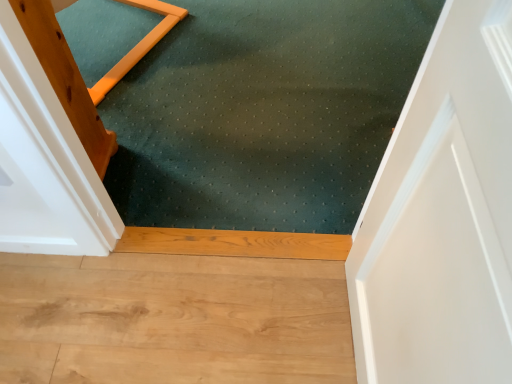
Image resolution: width=512 pixels, height=384 pixels. What do you see at coordinates (173, 320) in the screenshot?
I see `light brown wood flooring at lower center` at bounding box center [173, 320].

Measure the distance between point (138, 372) and camera.

1.07 meters.

Locate an element on the screen. This screenshot has height=384, width=512. light brown wood flooring at lower center is located at coordinates coord(173,320).

What do you see at coordinates (264, 113) in the screenshot?
I see `green textured mat at center` at bounding box center [264, 113].

Find the location of a particular element. This screenshot has height=384, width=512. green textured mat at center is located at coordinates (264, 113).

Where is `light brown wood flooring at lower center`? Image resolution: width=512 pixels, height=384 pixels. light brown wood flooring at lower center is located at coordinates (173, 320).

Which is more to the right, light brown wood flooring at lower center or green textured mat at center?

From the viewer's perspective, green textured mat at center appears more on the right side.

Is light brown wood flooring at lower center behind green textured mat at center?

No, it is in front of green textured mat at center.

Is point (177, 353) positioned before point (333, 178)?

Yes, it is.

From the image's perspective, relative to green textured mat at center, is light brown wood flooring at lower center above or below?

From the image's perspective, light brown wood flooring at lower center appears below green textured mat at center.

From a real-world perspective, is light brown wood flooring at lower center on top of green textured mat at center?

Incorrect, from a real-world perspective, light brown wood flooring at lower center is lower than green textured mat at center.

Does light brown wood flooring at lower center have a lesser width compared to green textured mat at center?

Correct, the width of light brown wood flooring at lower center is less than that of green textured mat at center.

Which of these two, light brown wood flooring at lower center or green textured mat at center, stands taller?

With more height is light brown wood flooring at lower center.

Considering the sizes of objects light brown wood flooring at lower center and green textured mat at center in the image provided, who is smaller, light brown wood flooring at lower center or green textured mat at center?

light brown wood flooring at lower center is smaller.

Can we say light brown wood flooring at lower center lies outside green textured mat at center?

Indeed, light brown wood flooring at lower center is completely outside green textured mat at center.

Would you consider light brown wood flooring at lower center to be distant from green textured mat at center?

No, light brown wood flooring at lower center is in close proximity to green textured mat at center.

Is light brown wood flooring at lower center positioned with its back to green textured mat at center?

light brown wood flooring at lower center is not turned away from green textured mat at center.

What's the angular difference between light brown wood flooring at lower center and green textured mat at center's facing directions?

The angle between the facing direction of light brown wood flooring at lower center and the facing direction of green textured mat at center is 180 degrees.

Locate an element on the screen. mat that is behind the light brown wood flooring at lower center is located at coordinates (264, 113).

In the scene shown: Is green textured mat at center to the left of light brown wood flooring at lower center from the viewer's perspective?

No.

Considering the relative positions of green textured mat at center and light brown wood flooring at lower center in the image provided, is green textured mat at center behind light brown wood flooring at lower center?

That is True.

Which is behind, point (303, 132) or point (24, 311)?

The point (303, 132) is behind.

From the image's perspective, would you say green textured mat at center is shown under light brown wood flooring at lower center?

No, from the image's perspective, green textured mat at center is not beneath light brown wood flooring at lower center.

From a real-world perspective, is green textured mat at center positioned above or below light brown wood flooring at lower center?

green textured mat at center is above light brown wood flooring at lower center.

Is green textured mat at center thinner than light brown wood flooring at lower center?

Incorrect, the width of green textured mat at center is not less than that of light brown wood flooring at lower center.

In terms of height, does green textured mat at center look taller or shorter compared to light brown wood flooring at lower center?

In the image, green textured mat at center appears to be shorter than light brown wood flooring at lower center.

Considering the sizes of green textured mat at center and light brown wood flooring at lower center in the image, is green textured mat at center bigger or smaller than light brown wood flooring at lower center?

green textured mat at center is bigger than light brown wood flooring at lower center.

Is green textured mat at center inside or outside of light brown wood flooring at lower center?

green textured mat at center is located beyond the bounds of light brown wood flooring at lower center.

Are green textured mat at center and light brown wood flooring at lower center far apart?

No, green textured mat at center is in close proximity to light brown wood flooring at lower center.

Could you tell me if green textured mat at center is facing light brown wood flooring at lower center?

Yes, green textured mat at center is turned towards light brown wood flooring at lower center.

What's the angular difference between green textured mat at center and light brown wood flooring at lower center's facing directions?

There is a 180-degree angle between the facing directions of green textured mat at center and light brown wood flooring at lower center.

The image size is (512, 384). In order to click on mat above the light brown wood flooring at lower center (from the image's perspective) in this screenshot , I will do `click(264, 113)`.

This screenshot has width=512, height=384. Find the location of `hardwood in front of the green textured mat at center`. hardwood in front of the green textured mat at center is located at coordinates (173, 320).

The image size is (512, 384). Identify the location of hardwood below the green textured mat at center (from the image's perspective). (173, 320).